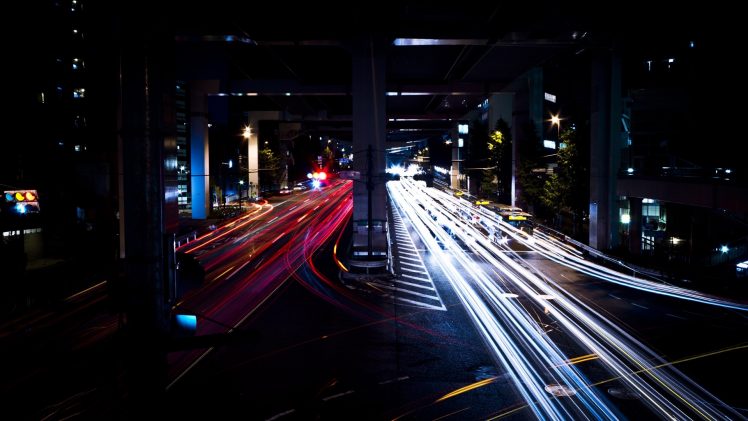
At what (x,y) coordinates should I click in order to perform the action: click on white round lights. Please return your answer as a coordinate pair (x, y). Looking at the image, I should click on (553, 122), (245, 133).